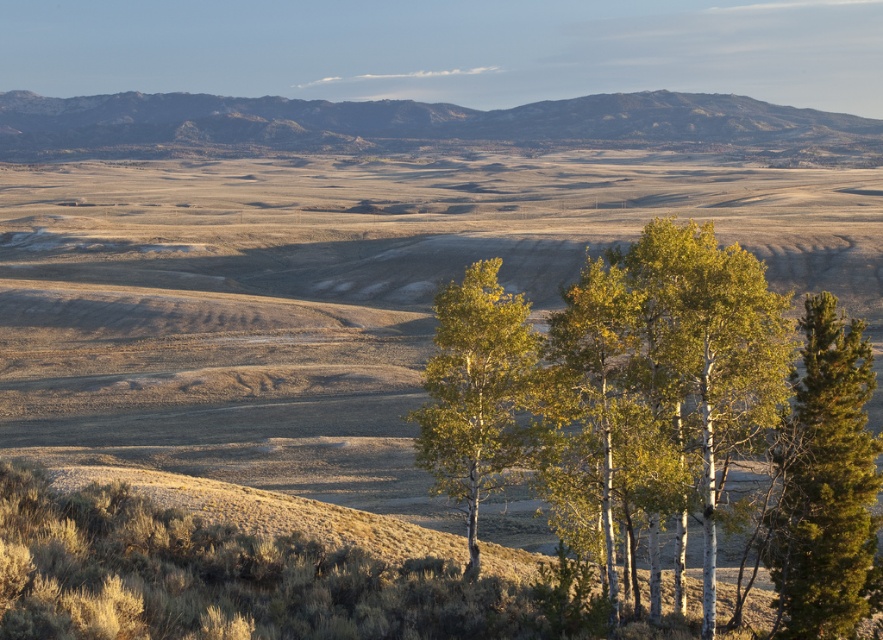
You are planning to climb the rocky brown mountain at upper center and the green leafy birch at center. Which one will require more effort due to its height?

The rocky brown mountain at upper center requires more effort to climb because it is taller than the green leafy birch at center according to the description.

You are standing at point (669, 412) in the landscape. What do you see around you?

You see green bark trees at center around you.

Based on the scene described, which object occupies a more prominent position in terms of size between the rocky brown mountain at upper center and the green leafy birch at center?

The rocky brown mountain at upper center is larger in size than the green leafy birch at center, making it more prominent in terms of size.